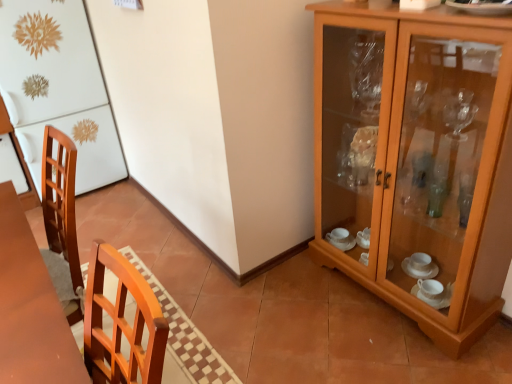
Where is `free spot in front of wooden cabinet at right`? The width and height of the screenshot is (512, 384). free spot in front of wooden cabinet at right is located at coordinates (405, 350).